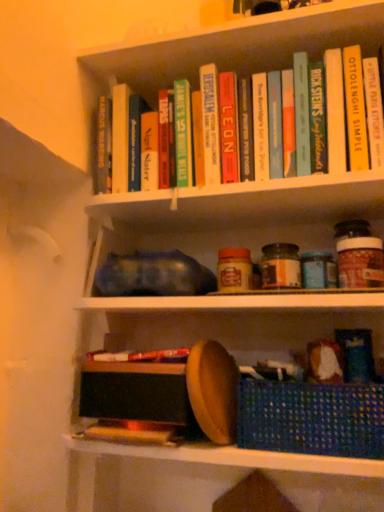
Question: Is blue woven basket at lower right with hardcover book at upper center, the second paperback book viewed from the left?

Choices:
 (A) no
 (B) yes

Answer: (A)

Question: Can you confirm if blue woven basket at lower right is bigger than hardcover book at upper center, the second paperback book viewed from the left?

Choices:
 (A) no
 (B) yes

Answer: (B)

Question: Is blue woven basket at lower right at the left side of hardcover book at upper center, the second paperback book viewed from the left?

Choices:
 (A) no
 (B) yes

Answer: (A)

Question: Does blue woven basket at lower right come in front of hardcover book at upper center, the third paperback book viewed from the right?

Choices:
 (A) no
 (B) yes

Answer: (B)

Question: Could you tell me if blue woven basket at lower right is facing hardcover book at upper center, the second paperback book viewed from the left?

Choices:
 (A) yes
 (B) no

Answer: (B)

Question: In the image, is hardcover book at upper center, the second paperback book when ordered from right to left, positioned in front of or behind hardcover book at upper center, the second paperback book viewed from the left?

Choices:
 (A) front
 (B) behind

Answer: (A)

Question: Looking at the image, does hardcover book at upper center, the second paperback book when ordered from right to left, seem bigger or smaller compared to hardcover book at upper center, the third paperback book viewed from the right?

Choices:
 (A) small
 (B) big

Answer: (A)

Question: From the image's perspective, is hardcover book at upper center, the 3th paperback book viewed from the left, above or below hardcover book at upper center, the third paperback book viewed from the right?

Choices:
 (A) above
 (B) below

Answer: (A)

Question: Is point (314, 156) closer or farther from the camera than point (228, 157)?

Choices:
 (A) farther
 (B) closer

Answer: (B)

Question: In terms of width, does blue woven basket at lower right look wider or thinner when compared to hardcover book at center, acting as the first paperback book starting from the left?

Choices:
 (A) wide
 (B) thin

Answer: (A)

Question: Is blue woven basket at lower right taller or shorter than hardcover book at center, acting as the first paperback book starting from the left?

Choices:
 (A) tall
 (B) short

Answer: (B)

Question: Is blue woven basket at lower right situated inside hardcover book at center, which is the fourth paperback book in right-to-left order, or outside?

Choices:
 (A) outside
 (B) inside

Answer: (A)

Question: From the image's perspective, relative to hardcover book at center, which is the fourth paperback book in right-to-left order, is blue woven basket at lower right above or below?

Choices:
 (A) below
 (B) above

Answer: (A)

Question: Do you think hardcover book at center, which is the fourth paperback book in right-to-left order, is within hardcover book at center, or outside of it?

Choices:
 (A) outside
 (B) inside

Answer: (A)

Question: Considering the positions of point (201, 97) and point (188, 352), is point (201, 97) closer or farther from the camera than point (188, 352)?

Choices:
 (A) closer
 (B) farther

Answer: (B)